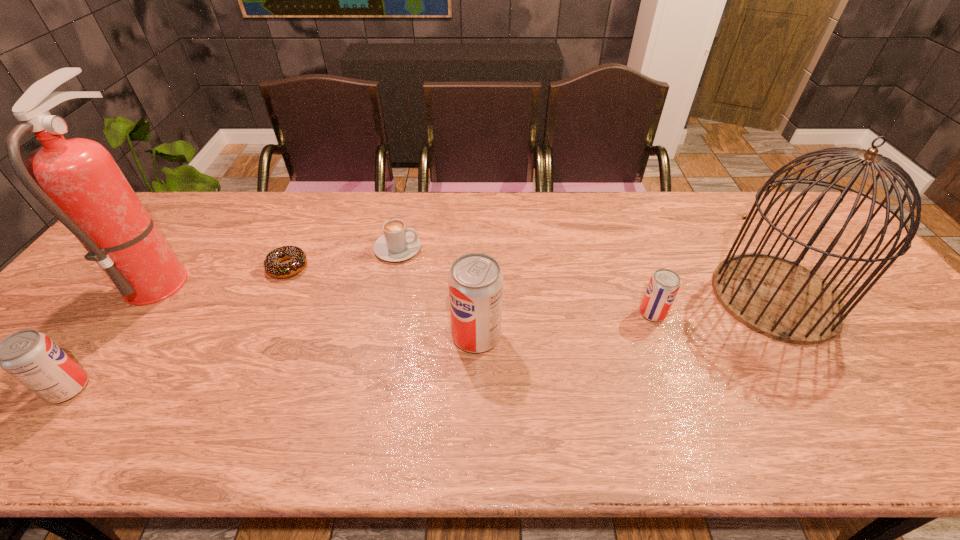
You are a GUI agent. You are given a task and a screenshot of the screen. Output one action in this format:
    pyautogui.click(x=<x>, y=<y>)
    Task: Click on the vacant space that's between the cappuccino and the tallest soda
    This screenshot has width=960, height=540.
    Given the screenshot: What is the action you would take?
    pyautogui.click(x=437, y=292)

Select which object appears as the second closest to the doughnut. Please provide its 2D coordinates. Your answer should be formatted as a tuple, i.e. [(x, y)], where the tuple contains the x and y coordinates of a point satisfying the conditions above.

[(77, 180)]

Locate which object is the closest to the fifth tallest object. Please provide its 2D coordinates. Your answer should be formatted as a tuple, i.e. [(x, y)], where the tuple contains the x and y coordinates of a point satisfying the conditions above.

[(778, 298)]

Image resolution: width=960 pixels, height=540 pixels. I want to click on soda that can be found as the second closest to the shortest object, so click(x=475, y=281).

Where is `soda object that ranks as the second closest to the tallest soda`? The image size is (960, 540). soda object that ranks as the second closest to the tallest soda is located at coordinates (31, 357).

Identify the location of vacant space that satisfies the following two spatial constraints: 1. on the back side of the third tallest object; 2. with the handle and hose on the fire extinguisher. (477, 278).

Where is `free space in the image that satisfies the following two spatial constraints: 1. at the door of the birdcage; 2. on the front side of the tallest soda`? The height and width of the screenshot is (540, 960). free space in the image that satisfies the following two spatial constraints: 1. at the door of the birdcage; 2. on the front side of the tallest soda is located at coordinates (800, 335).

Where is `free space that satisfies the following two spatial constraints: 1. to the right of the sixth object from left to right; 2. on the left side of the fourth object from right to left`? free space that satisfies the following two spatial constraints: 1. to the right of the sixth object from left to right; 2. on the left side of the fourth object from right to left is located at coordinates (385, 313).

The height and width of the screenshot is (540, 960). I want to click on vacant space that satisfies the following two spatial constraints: 1. to the right of the third object from right to left; 2. on the right side of the fourth object from left to right, so click(380, 335).

Image resolution: width=960 pixels, height=540 pixels. What are the coordinates of `vacant position in the image that satisfies the following two spatial constraints: 1. to the right of the cappuccino; 2. on the left side of the sixth object from left to right` in the screenshot? It's located at (385, 313).